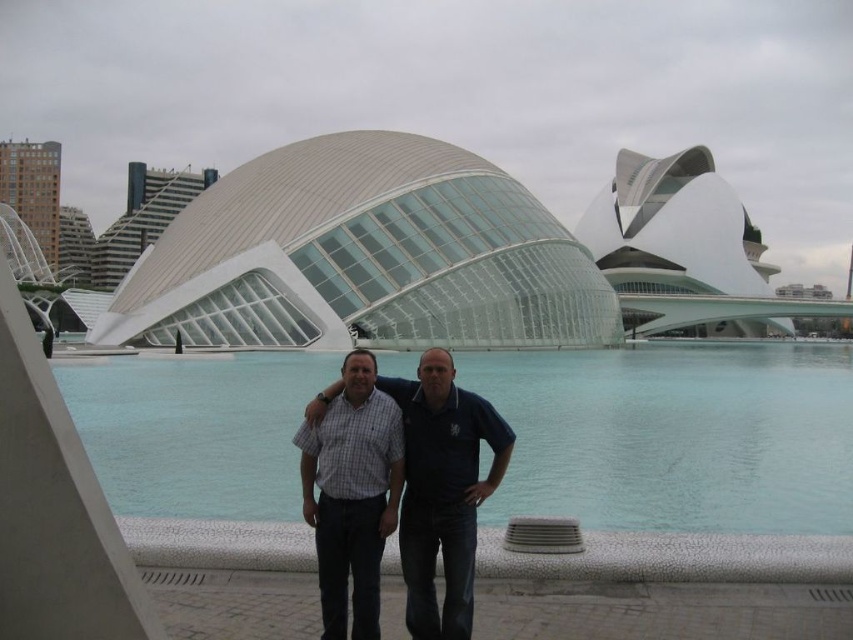
Is transparent glass water at center below checkered fabric shirt at center?

No, transparent glass water at center is not below checkered fabric shirt at center.

Who is positioned more to the right, transparent glass water at center or checkered fabric shirt at center?

transparent glass water at center is more to the right.

Which is in front, point (265, 513) or point (347, 442)?

Point (347, 442)

What are the coordinates of `transparent glass water at center` in the screenshot? It's located at (675, 435).

Based on the photo, can you confirm if transparent glass water at center is positioned below dark blue shirt at center?

Actually, transparent glass water at center is above dark blue shirt at center.

From the picture: Does transparent glass water at center come behind dark blue shirt at center?

Yes, transparent glass water at center is further from the viewer.

Is point (172, 508) behind point (405, 493)?

Yes, it is behind point (405, 493).

The image size is (853, 640). I want to click on transparent glass water at center, so click(x=675, y=435).

In the scene shown: Which of these two, dark blue shirt at center or checkered fabric shirt at center, stands shorter?

dark blue shirt at center

Can you confirm if dark blue shirt at center is positioned above checkered fabric shirt at center?

Incorrect, dark blue shirt at center is not positioned above checkered fabric shirt at center.

I want to click on dark blue shirt at center, so click(x=442, y=490).